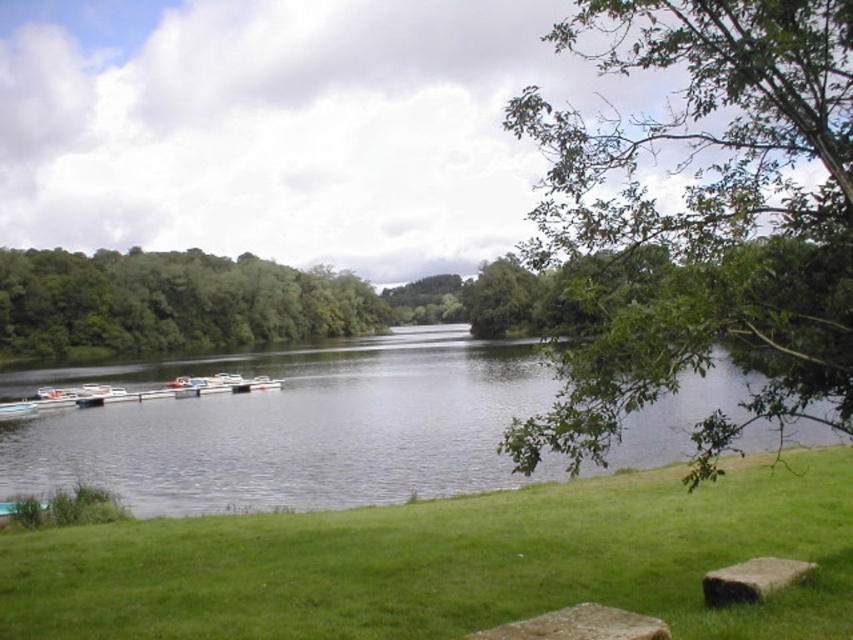
Is the position of green grassy at lower left more distant than that of rustic stone bench at lower center?

Yes, it is behind rustic stone bench at lower center.

From the picture: Who is more forward, [677,600] or [637,628]?

Point [637,628] is more forward.

The height and width of the screenshot is (640, 853). What do you see at coordinates (450, 563) in the screenshot?
I see `green grassy at lower left` at bounding box center [450, 563].

You are a GUI agent. You are given a task and a screenshot of the screen. Output one action in this format:
    pyautogui.click(x=<x>, y=<y>)
    Task: Click on the green grassy at lower left
    This screenshot has width=853, height=640.
    Given the screenshot: What is the action you would take?
    pyautogui.click(x=450, y=563)

Is point (659, 598) positioned behind point (76, 385)?

No, it is in front of (76, 385).

Does green grassy at lower left have a smaller size compared to white plastic boats at lower left?

Yes, green grassy at lower left is smaller than white plastic boats at lower left.

Describe the element at coordinates (450, 563) in the screenshot. This screenshot has width=853, height=640. I see `green grassy at lower left` at that location.

Where is `green grassy at lower left`? green grassy at lower left is located at coordinates (450, 563).

Is point (741, 243) positioned in front of point (218, 381)?

Yes, it is.

In the scene shown: Which is above, green leafy tree at upper right or white plastic boats at lower left?

green leafy tree at upper right is above.

Find the location of a particular element. The width and height of the screenshot is (853, 640). green leafy tree at upper right is located at coordinates (706, 218).